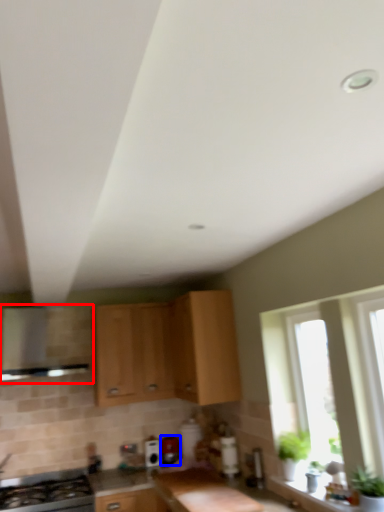
Question: Which object is further to the camera taking this photo, vent (highlighted by a red box) or appliance (highlighted by a blue box)?

Choices:
 (A) vent
 (B) appliance

Answer: (B)